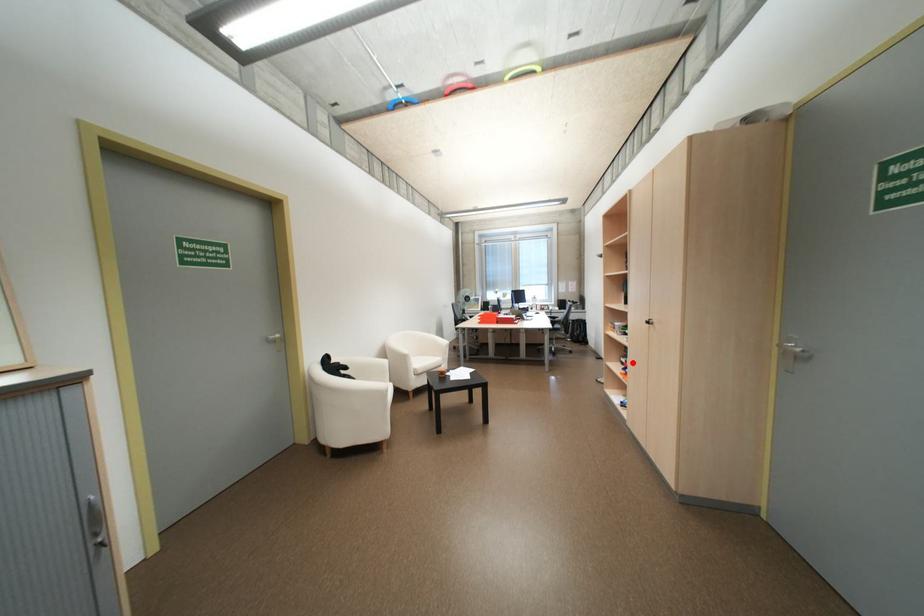
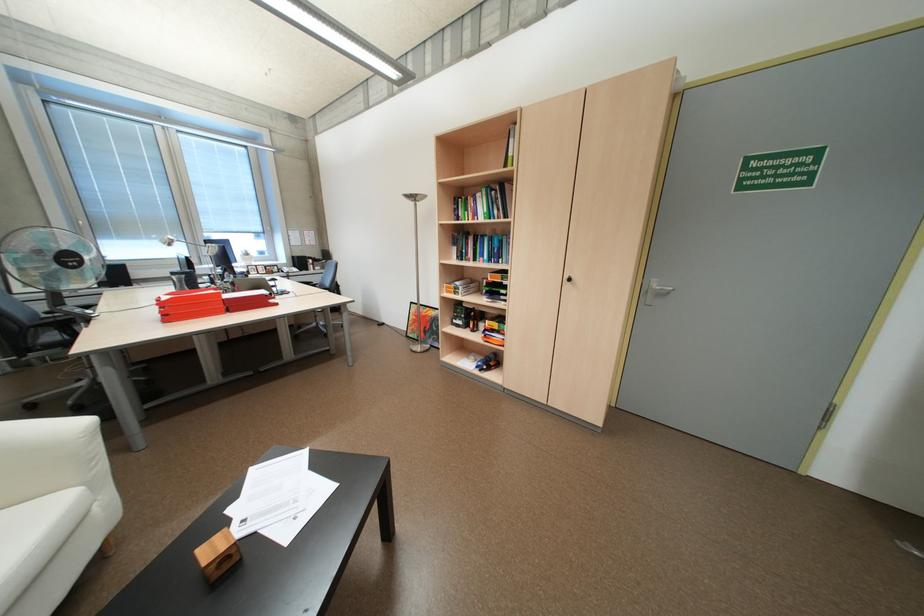
Question: I am providing you with two images of the same scene from different viewpoints. A red point is shown in image1. For the corresponding object point in image2, is it positioned nearer or farther from the camera?

Choices:
 (A) Nearer
 (B) Farther

Answer: (B)